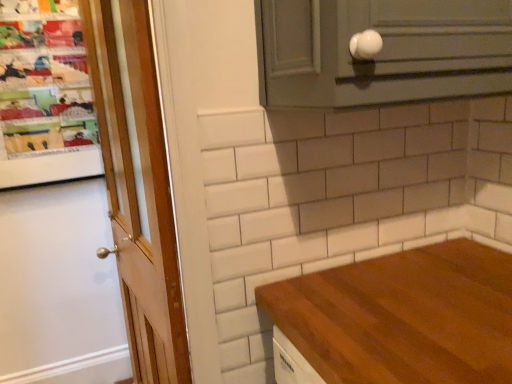
You are a GUI agent. You are given a task and a screenshot of the screen. Output one action in this format:
    pyautogui.click(x=<x>, y=<y>)
    Task: Click on the wooden door at left
    The height and width of the screenshot is (384, 512).
    Given the screenshot: What is the action you would take?
    pyautogui.click(x=138, y=186)

What do you see at coordinates (138, 186) in the screenshot? I see `wooden door at left` at bounding box center [138, 186].

Describe the element at coordinates (381, 51) in the screenshot. I see `white glossy knob at upper right` at that location.

Image resolution: width=512 pixels, height=384 pixels. In order to click on white glossy knob at upper right in this screenshot , I will do `click(381, 51)`.

In order to face white glossy knob at upper right, should I rotate leftwards or rightwards?

To align with it, rotate right about 21.284°.

Locate an element on the screen. wooden door at left is located at coordinates (138, 186).

Which object is positioned more to the right, white glossy knob at upper right or wooden door at left?

Positioned to the right is white glossy knob at upper right.

Is white glossy knob at upper right in front of or behind wooden door at left in the image?

white glossy knob at upper right is positioned closer to the viewer than wooden door at left.

Is point (418, 24) closer or farther from the camera than point (106, 158)?

Point (418, 24) is closer to the camera than point (106, 158).

From the image's perspective, which is below, white glossy knob at upper right or wooden door at left?

From the image's view, wooden door at left is below.

From a real-world perspective, between white glossy knob at upper right and wooden door at left, who is vertically higher?

white glossy knob at upper right, from a real-world perspective.

Is white glossy knob at upper right wider than wooden door at left?

Indeed, white glossy knob at upper right has a greater width compared to wooden door at left.

Between white glossy knob at upper right and wooden door at left, which one has more height?

Standing taller between the two is wooden door at left.

Considering the relative sizes of white glossy knob at upper right and wooden door at left in the image provided, is white glossy knob at upper right bigger than wooden door at left?

No.

Consider the image. Do you think white glossy knob at upper right is within wooden door at left, or outside of it?

white glossy knob at upper right lies outside wooden door at left.

Based on the photo, would you say white glossy knob at upper right is a long distance from wooden door at left?

No, there isn't a large distance between white glossy knob at upper right and wooden door at left.

Is white glossy knob at upper right facing towards wooden door at left?

No, white glossy knob at upper right does not turn towards wooden door at left.

Image resolution: width=512 pixels, height=384 pixels. Find the location of `door below the white glossy knob at upper right (from the image's perspective)`. door below the white glossy knob at upper right (from the image's perspective) is located at coordinates (138, 186).

Can you confirm if wooden door at left is positioned to the left of white glossy knob at upper right?

Correct, you'll find wooden door at left to the left of white glossy knob at upper right.

Between wooden door at left and white glossy knob at upper right, which one is positioned behind?

wooden door at left is further from the camera.

Does point (148, 39) lie behind point (297, 7)?

Yes, point (148, 39) is behind point (297, 7).

From the image's perspective, which one is positioned higher, wooden door at left or white glossy knob at upper right?

white glossy knob at upper right appears higher in the image.

From a real-world perspective, does wooden door at left stand above white glossy knob at upper right?

No, from a real-world perspective, wooden door at left is not on top of white glossy knob at upper right.

In the scene shown: In terms of width, does wooden door at left look wider or thinner when compared to white glossy knob at upper right?

Considering their sizes, wooden door at left looks slimmer than white glossy knob at upper right.

In the scene shown: Can you confirm if wooden door at left is taller than white glossy knob at upper right?

Indeed, wooden door at left has a greater height compared to white glossy knob at upper right.

Which of these two, wooden door at left or white glossy knob at upper right, is bigger?

wooden door at left is bigger.

Is wooden door at left situated inside white glossy knob at upper right or outside?

wooden door at left is spatially situated outside white glossy knob at upper right.

Is the surface of wooden door at left in direct contact with white glossy knob at upper right?

wooden door at left and white glossy knob at upper right are not in contact.

Is wooden door at left turned away from white glossy knob at upper right?

wooden door at left is not turned away from white glossy knob at upper right.

Can you tell me how much wooden door at left and white glossy knob at upper right differ in facing direction?

They differ by 81.1 degrees in their facing directions.

Locate an element on the screen. This screenshot has width=512, height=384. door below the white glossy knob at upper right (from a real-world perspective) is located at coordinates (138, 186).

You are a GUI agent. You are given a task and a screenshot of the screen. Output one action in this format:
    pyautogui.click(x=<x>, y=<y>)
    Task: Click on the door that is under the white glossy knob at upper right (from a real-world perspective)
    
    Given the screenshot: What is the action you would take?
    pyautogui.click(x=138, y=186)

Image resolution: width=512 pixels, height=384 pixels. I want to click on door below the white glossy knob at upper right (from the image's perspective), so click(138, 186).